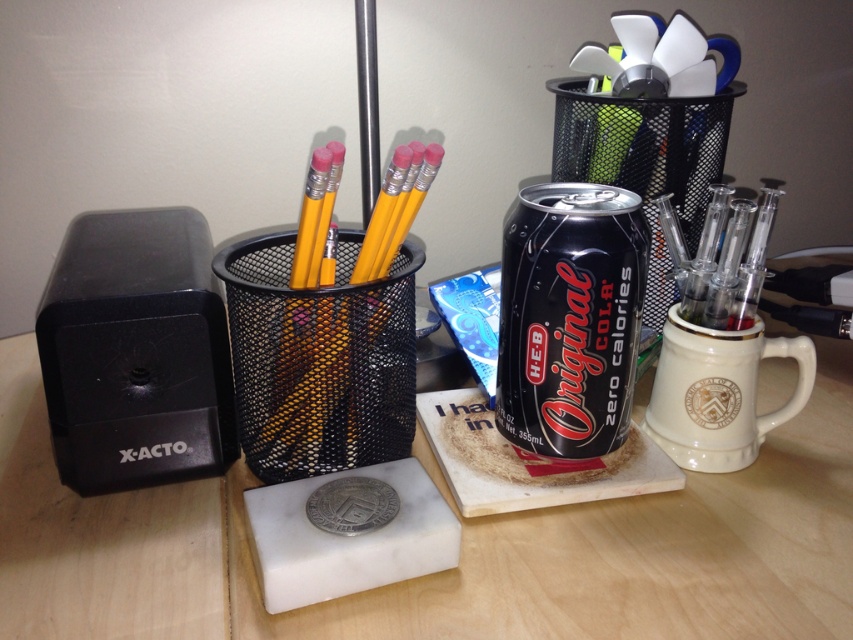
Does point (235, 604) come closer to viewer compared to point (512, 218)?

That is True.

Is point (601, 612) closer to viewer compared to point (537, 200)?

Yes, it is in front of point (537, 200).

Locate an element on the screen. wooden table at center is located at coordinates (460, 548).

Is point (167, 285) positioned before point (643, 276)?

Yes, it is.

Between point (86, 220) and point (506, 316), which one is positioned in front?

Point (506, 316) is in front.

Find the location of a particular element. This screenshot has height=640, width=853. black plastic sharpener at left is located at coordinates (135, 353).

Who is more forward, (242, 467) or (728, 340)?

Point (728, 340) is more forward.

Does wooden table at center have a greater width compared to white ceramic mug at right?

Correct, the width of wooden table at center exceeds that of white ceramic mug at right.

Is point (682, 570) farther from viewer compared to point (640, 422)?

No, it is not.

Locate an element on the screen. wooden table at center is located at coordinates (460, 548).